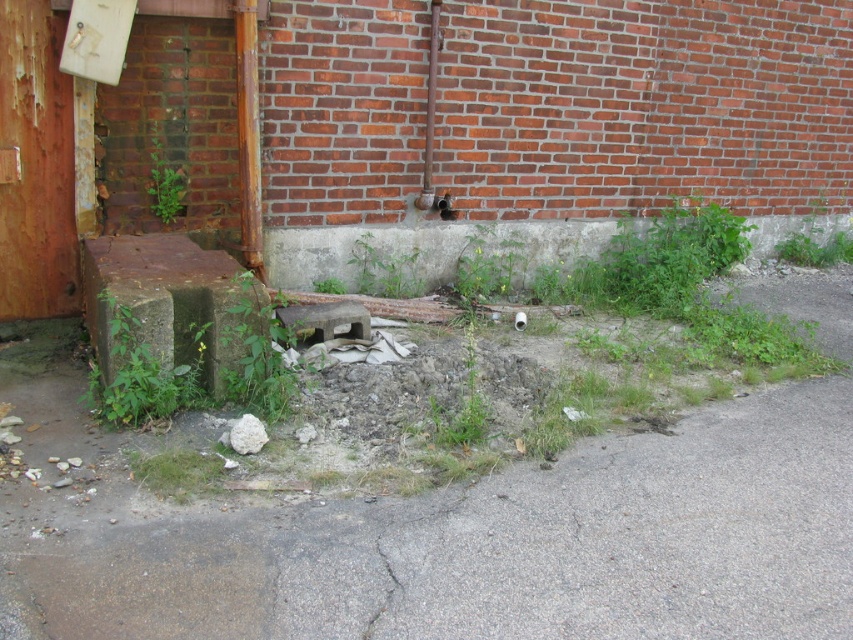
You are a gardener who needs to access the green leafy weed at center to remove it. The gray asphalt pavement at lower center is in your way. Can you move around the weed to the left side to reach it?

The gray asphalt pavement at lower center is positioned on the right side of green leafy weed at center, so you can move around the weed to the left side to reach it.

You are standing at the entrance of the building and want to walk to the gray asphalt pavement at lower center. According to the coordinates provided, where should you head?

The gray asphalt pavement at lower center is located at coordinates point [486,545], so you should head towards that point.

You are a gardener trying to clear the area around the gray asphalt pavement at lower center and the green leafy weed at center. Which object should you prioritize removing first if you want to focus on the smaller one?

You should prioritize removing the green leafy weed at center first since it is smaller than the gray asphalt pavement at lower center.